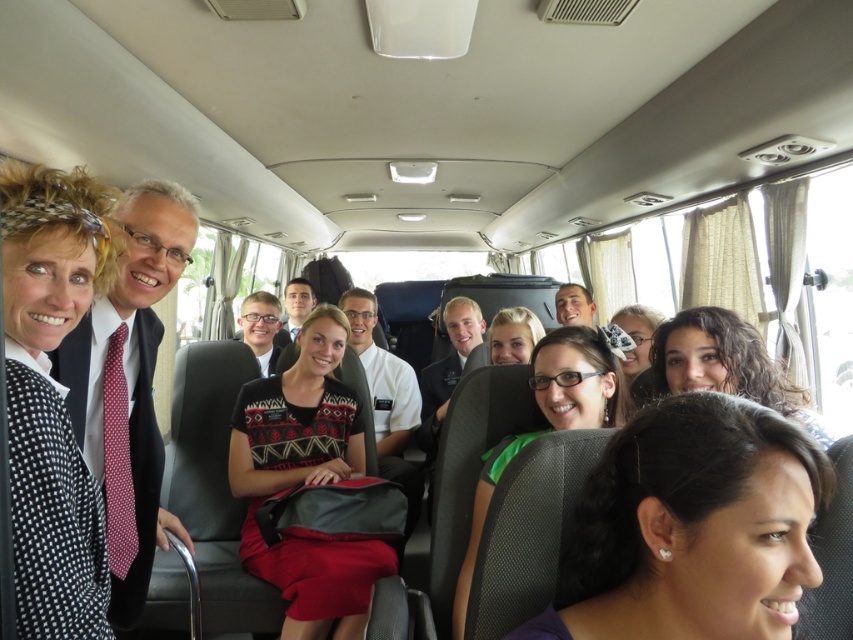
Question: Which object is positioned closest to the knit sweater at center?

Choices:
 (A) light blue uniform at center
 (B) green fabric shirt at center

Answer: (B)

Question: Which point is farther to the camera?

Choices:
 (A) polished dark wood chair at left
 (B) matte white shirt at center
 (C) curly brown hair at center
 (D) red dotted tie at left

Answer: (B)

Question: Is matte black hair at center thinner than smooth white shirt at center?

Choices:
 (A) yes
 (B) no

Answer: (A)

Question: Estimate the real-world distances between objects in this image. Which object is closer to the matte black suit at center?

Choices:
 (A) red silk tie at center
 (B) white cotton shirt at center
 (C) matte black hair at center
 (D) polka dot fabric jacket at left

Answer: (B)

Question: Is knit sweater at center to the left of light blue uniform at center from the viewer's perspective?

Choices:
 (A) yes
 (B) no

Answer: (A)

Question: Does light blue uniform at center appear over matte white shirt at center?

Choices:
 (A) no
 (B) yes

Answer: (A)